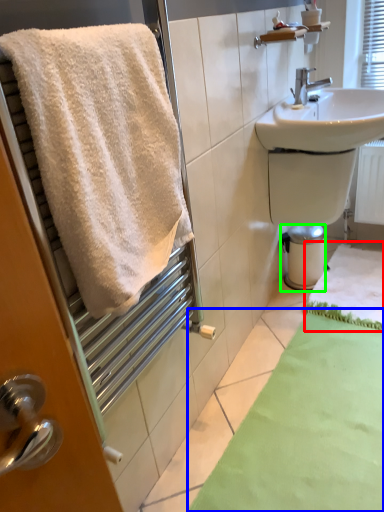
Question: Based on their relative distances, which object is nearer to bath mat (highlighted by a red box)? Choose from bath mat (highlighted by a blue box) and bidet (highlighted by a green box).

Choices:
 (A) bath mat
 (B) bidet

Answer: (B)